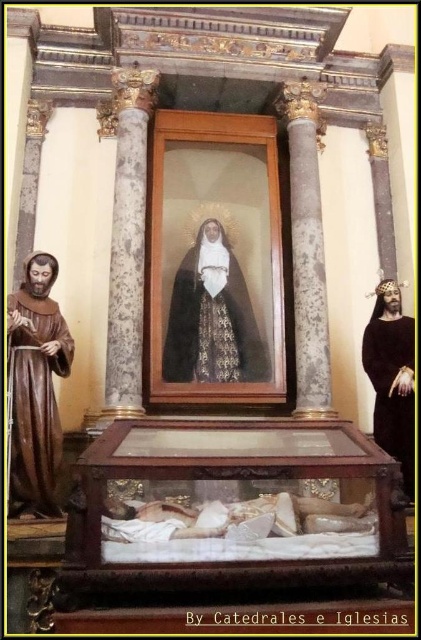
Is point (136, 502) more distant than point (408, 390)?

No, it is not.

Does wooden sarcophagus at center have a lesser height compared to black velvet robe at right?

Yes, wooden sarcophagus at center is shorter than black velvet robe at right.

You are a GUI agent. You are given a task and a screenshot of the screen. Output one action in this format:
    pyautogui.click(x=<x>, y=<y>)
    Task: Click on the wooden sarcophagus at center
    Image resolution: width=421 pixels, height=640 pixels.
    Given the screenshot: What is the action you would take?
    pyautogui.click(x=232, y=512)

Is black velvet robe at center to the left of black velvet robe at right from the viewer's perspective?

Indeed, black velvet robe at center is positioned on the left side of black velvet robe at right.

Between point (231, 378) and point (376, 378), which one is positioned in front?

Point (376, 378) is more forward.

At what (x,y) coordinates should I click in order to perform the action: click on black velvet robe at center. Please return your answer as a coordinate pair (x, y). The width and height of the screenshot is (421, 640). Looking at the image, I should click on (212, 317).

Who is taller, wooden sarcophagus at center or brown wooden statue at left?

brown wooden statue at left

Can you confirm if wooden sarcophagus at center is thinner than brown wooden statue at left?

No, wooden sarcophagus at center is not thinner than brown wooden statue at left.

Is point (269, 428) farther from camera compared to point (31, 429)?

No, it is in front of (31, 429).

What are the coordinates of `wooden sarcophagus at center` in the screenshot? It's located at (232, 512).